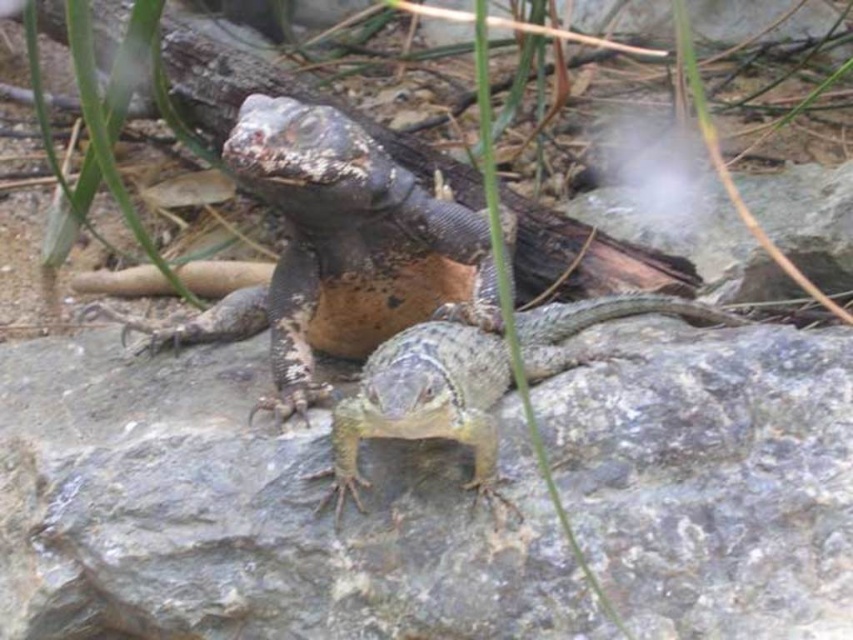
You are a photographer trying to capture both the gray rock at center and the smooth gray lizard at center in a single frame. Based on their heights, which one will appear larger in the photo?

The gray rock at center is taller than the smooth gray lizard at center, so it will appear larger in the photo.

You are a photographer trying to capture a clear photo of both the leathery brown lizard at center and the smooth gray lizard at center. Which lizard will appear larger in the photo?

The leathery brown lizard at center will appear larger in the photo because it is closer to the camera than the smooth gray lizard at center.